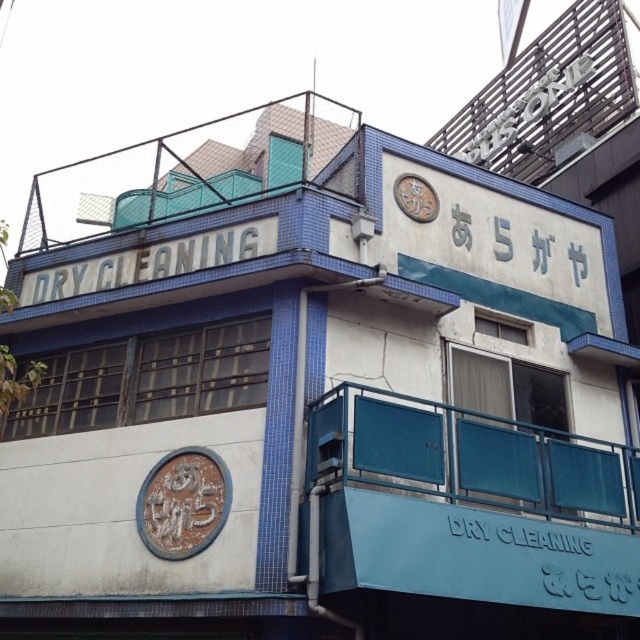
Question: Does white painted metal sign at upper center appear on the left side of white metallic sign at center?

Choices:
 (A) no
 (B) yes

Answer: (B)

Question: Which of the following is the farthest from the observer?

Choices:
 (A) (330, 483)
 (B) (198, 250)
 (C) (404, 180)
 (D) (572, 260)

Answer: (D)

Question: Which of the following is the farthest from the observer?

Choices:
 (A) (221, 253)
 (B) (602, 451)
 (C) (540, 529)

Answer: (A)

Question: Is white metallic sign at center to the left of brown textured clock at upper center from the viewer's perspective?

Choices:
 (A) no
 (B) yes

Answer: (A)

Question: Which object is positioned closest to the white metallic sign at center?

Choices:
 (A) white painted metal sign at upper center
 (B) brown textured clock at upper center

Answer: (B)

Question: Is white painted metal sign at upper center smaller than white metallic sign at center?

Choices:
 (A) yes
 (B) no

Answer: (B)